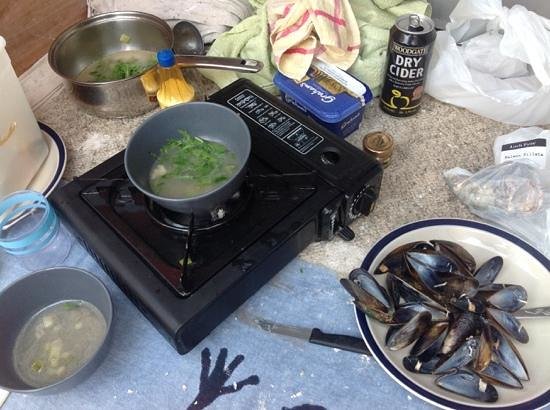
At what (x,y) coordinates should I click in order to perform the action: click on pot. Please return your answer as a coordinate pair (x, y). This screenshot has width=550, height=410. Looking at the image, I should click on (110, 97).